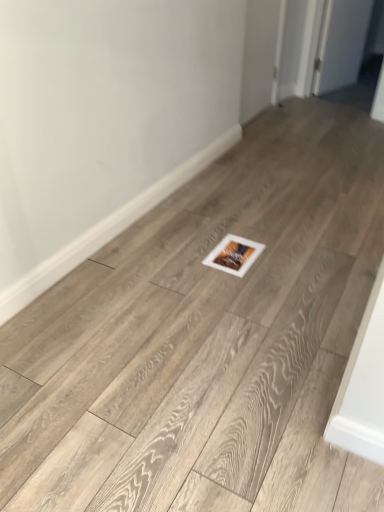
Image resolution: width=384 pixels, height=512 pixels. What are the coordinates of `free spot below white matte picture frame at center (from a real-world perspective)` in the screenshot? It's located at (233, 250).